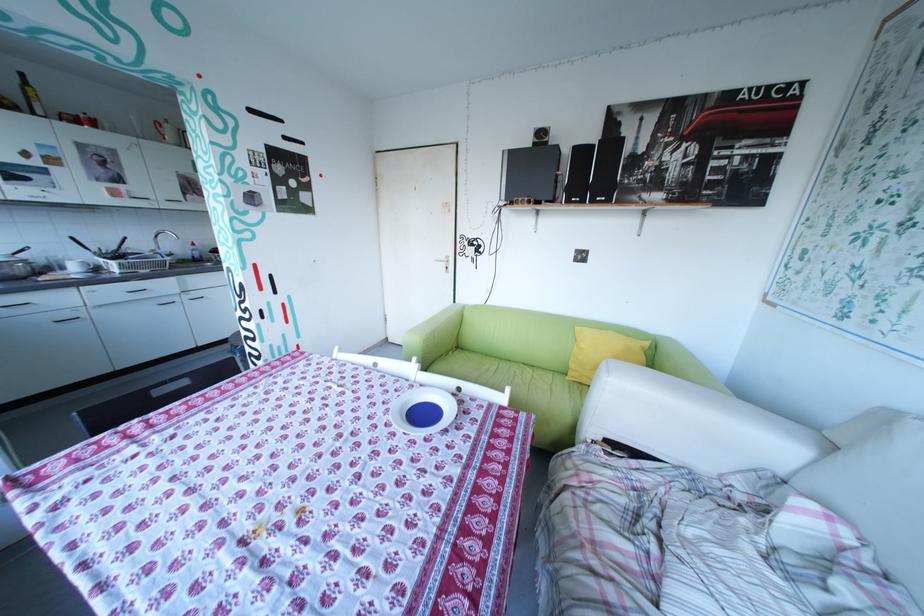
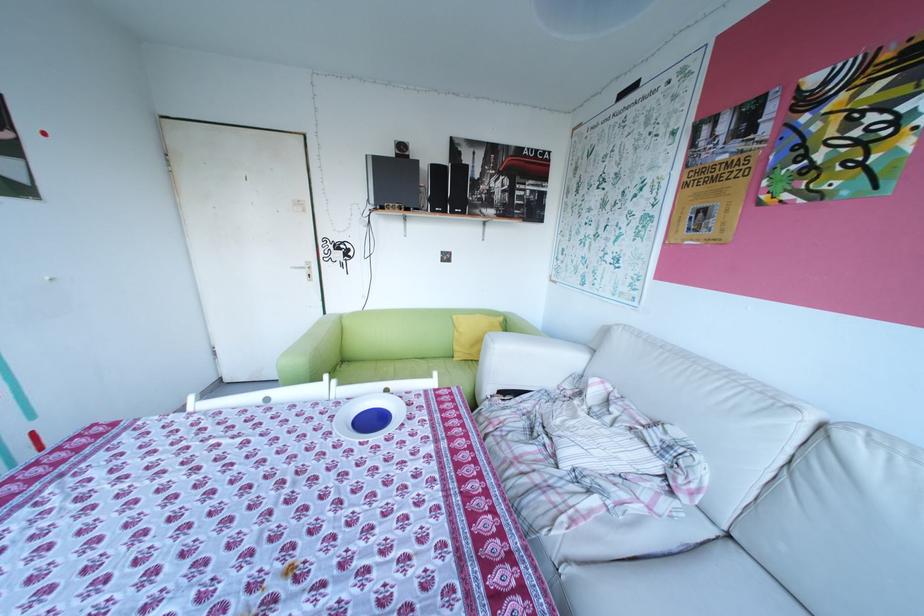
The point at (467, 302) is marked in the first image. Where is the corresponding point in the second image?

(337, 313)